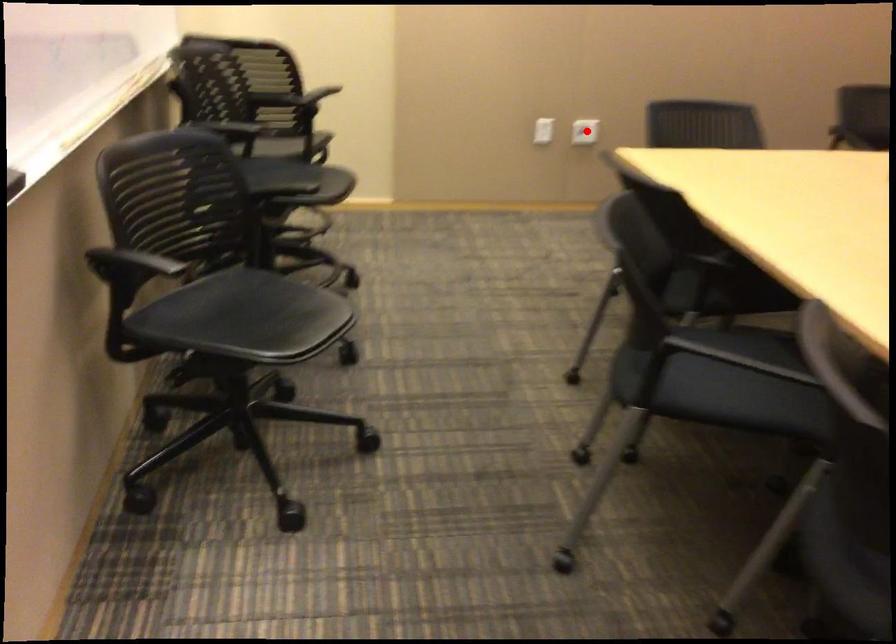
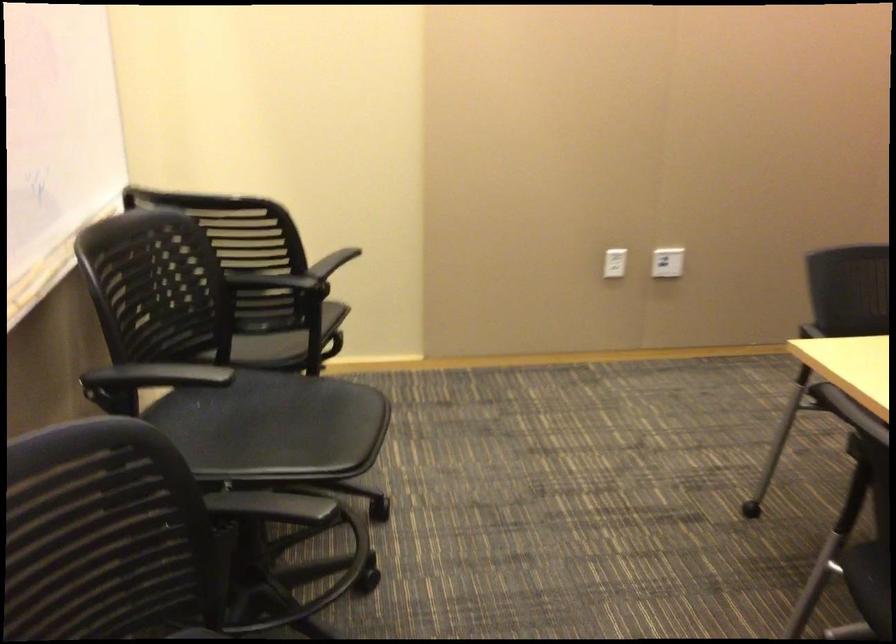
Question: I am providing you with two images of the same scene from different viewpoints. A red point is shown in image1. For the corresponding object point in image2, is it positioned nearer or farther from the camera?

Choices:
 (A) Nearer
 (B) Farther

Answer: (A)